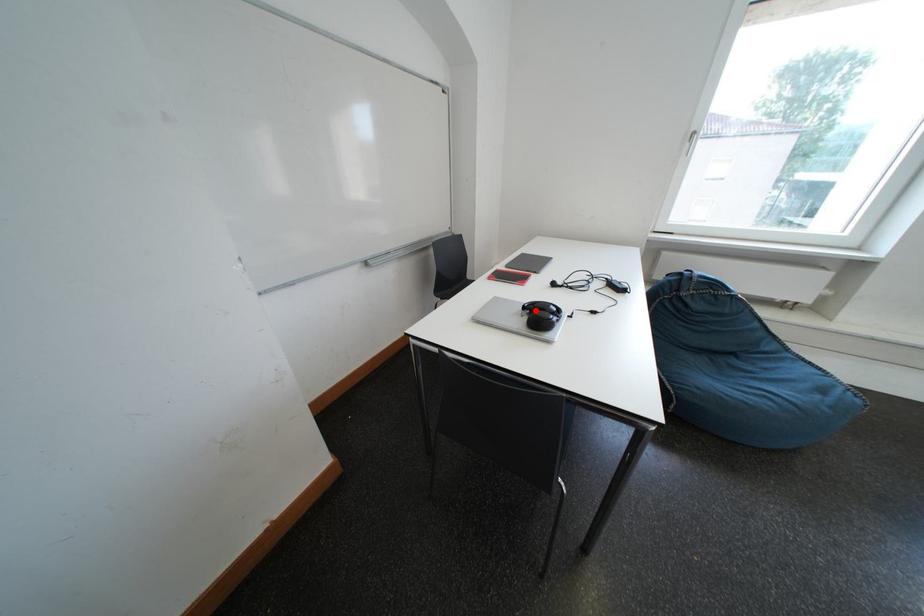
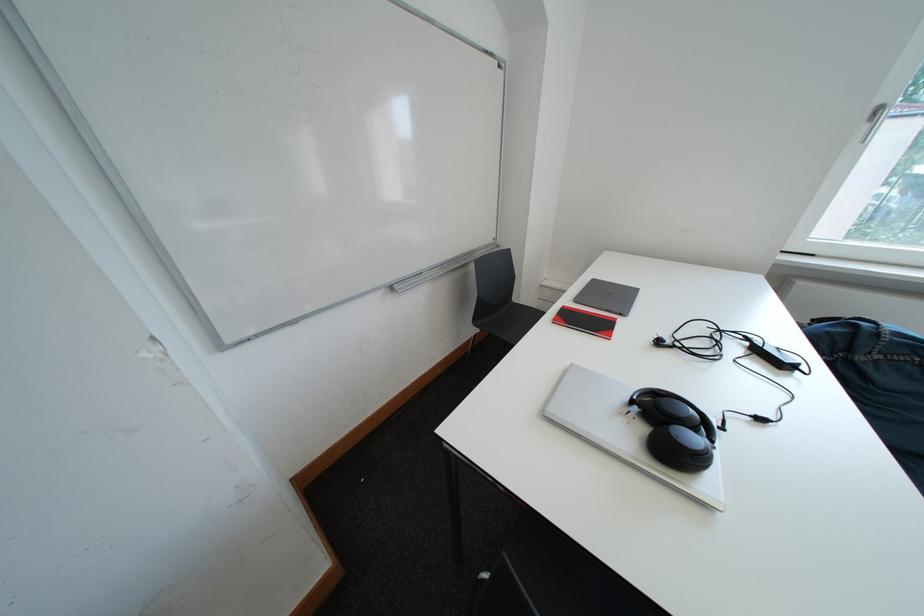
Where in the second image is the point corresponding to the highlighted location from the first image?

(642, 405)